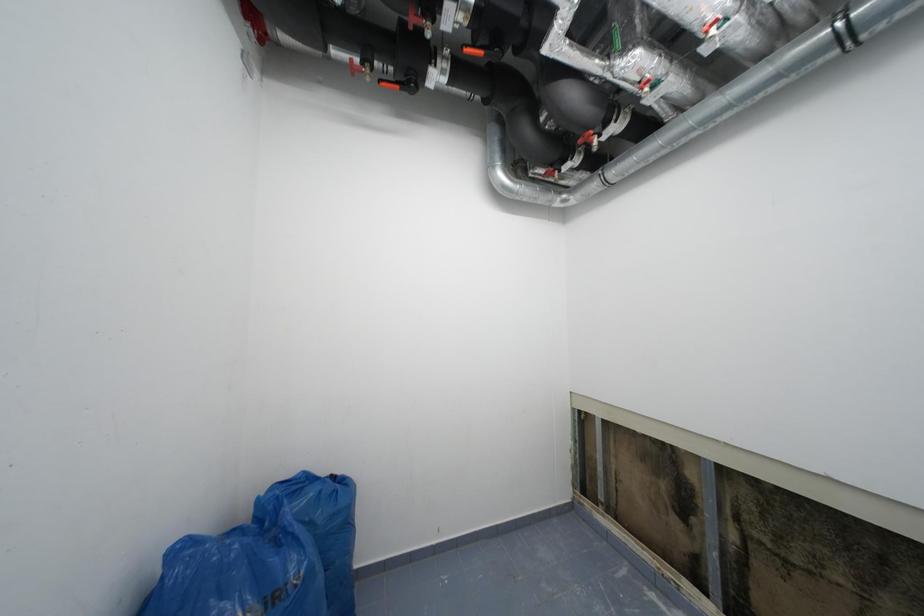
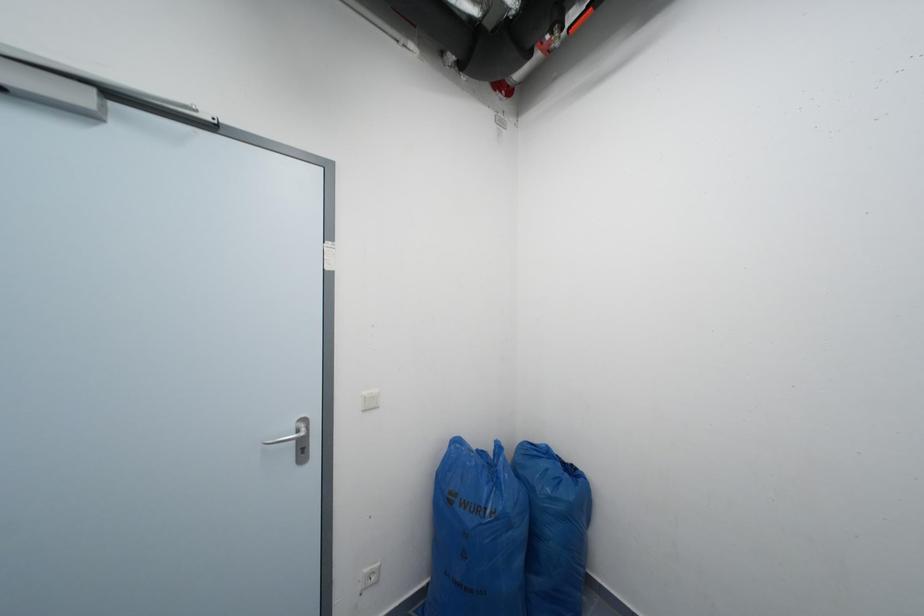
Question: The images are taken continuously from a first-person perspective. In which direction is your viewpoint rotating?

Choices:
 (A) Left
 (B) Right
 (C) Up
 (D) Down

Answer: (A)